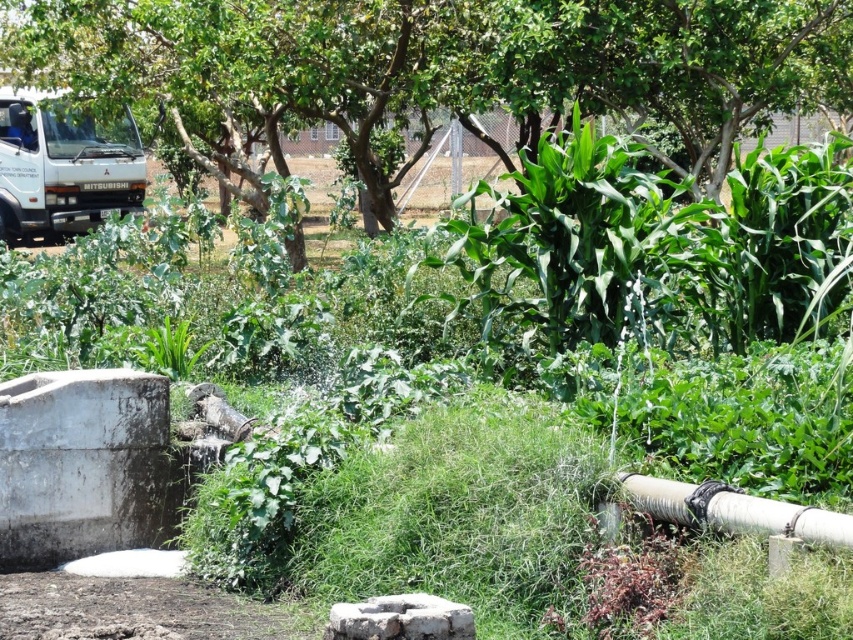
Is white matte truck at upper left smaller than white rubber pipe at lower right?

Incorrect, white matte truck at upper left is not smaller in size than white rubber pipe at lower right.

Which is behind, point (123, 193) or point (698, 500)?

The point (123, 193) is more distant.

The height and width of the screenshot is (640, 853). I want to click on white matte truck at upper left, so 62,170.

Can you confirm if green leafy tree at upper center is wider than white matte truck at upper left?

Yes, green leafy tree at upper center is wider than white matte truck at upper left.

Identify the location of green leafy tree at upper center. (440, 70).

I want to click on green leafy tree at upper center, so click(x=440, y=70).

Does green leafy tree at upper center appear on the left side of white rubber pipe at lower right?

Yes, green leafy tree at upper center is to the left of white rubber pipe at lower right.

Between green leafy tree at upper center and white rubber pipe at lower right, which one is positioned lower?

white rubber pipe at lower right is below.

Describe the element at coordinates (440, 70) in the screenshot. I see `green leafy tree at upper center` at that location.

Where is `green leafy tree at upper center`? This screenshot has height=640, width=853. green leafy tree at upper center is located at coordinates (440, 70).